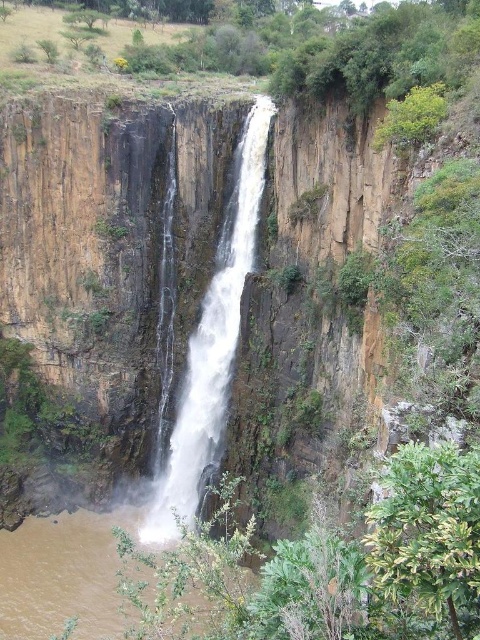
Describe the element at coordinates (178, 289) in the screenshot. I see `brown rock cliff at center` at that location.

Who is positioned more to the left, brown rock cliff at center or brown muddy water at lower center?

Positioned to the left is brown muddy water at lower center.

Is point (98, 140) closer to camera compared to point (61, 525)?

Yes.

I want to click on brown rock cliff at center, so click(178, 289).

Which is in front, point (79, 236) or point (242, 138)?

Positioned in front is point (242, 138).

Who is more forward, (277, 259) or (216, 355)?

Point (277, 259) is in front.

Find the location of `brown rock cliff at center`. brown rock cliff at center is located at coordinates (178, 289).

Which is above, white frothy water at center or brown muddy water at lower center?

white frothy water at center is higher up.

Who is lower down, white frothy water at center or brown muddy water at lower center?

brown muddy water at lower center is lower down.

At what (x,y) coordinates should I click in order to perform the action: click on white frothy water at center. Please return your answer as a coordinate pair (x, y). This screenshot has height=640, width=480. Looking at the image, I should click on (212, 346).